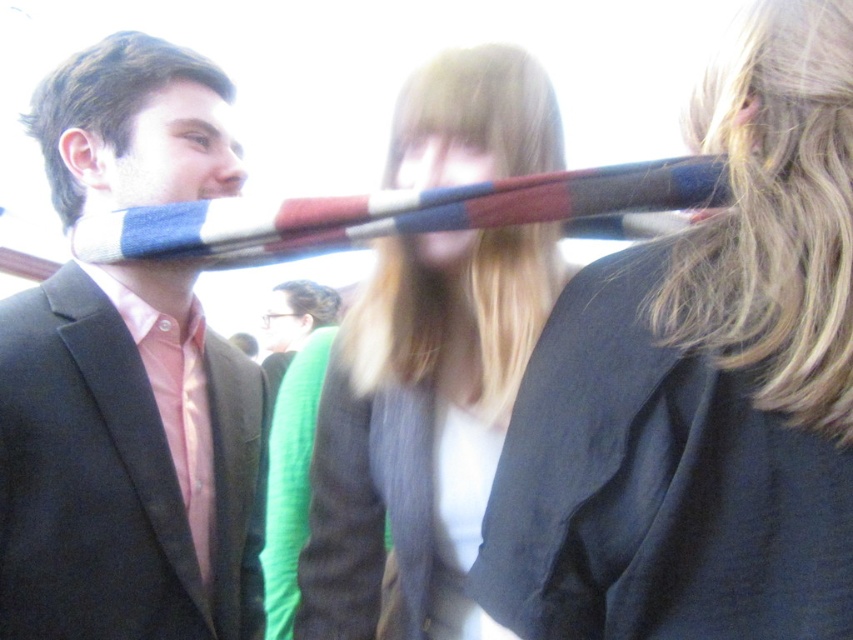
Question: Does blonde hair at center come in front of green knit sweater at center?

Choices:
 (A) yes
 (B) no

Answer: (A)

Question: Which point is farther from the camera taking this photo?

Choices:
 (A) (811, 336)
 (B) (207, 486)
 (C) (265, 627)

Answer: (C)

Question: Can you confirm if green knit sweater at center is positioned above satin pink tie at left?

Choices:
 (A) no
 (B) yes

Answer: (A)

Question: Among these points, which one is farthest from the camera?

Choices:
 (A) (204, 595)
 (B) (309, 384)
 (C) (144, 592)

Answer: (B)

Question: Is green knit sweater at center positioned before satin pink tie at left?

Choices:
 (A) yes
 (B) no

Answer: (B)

Question: Which object is closer to the camera taking this photo?

Choices:
 (A) matte black suit at left
 (B) green knit sweater at center
 (C) blonde hair at center

Answer: (A)